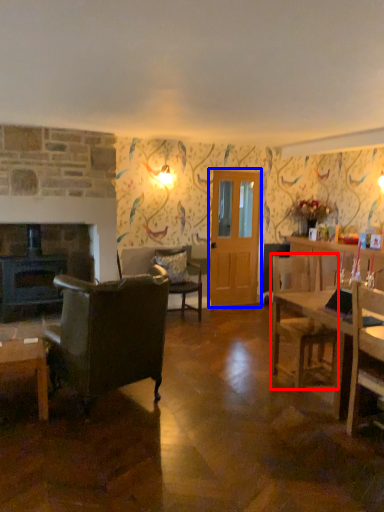
Question: Which point is closer to the camera, chair (highlighted by a red box) or glass door (highlighted by a blue box)?

Choices:
 (A) chair
 (B) glass door

Answer: (A)